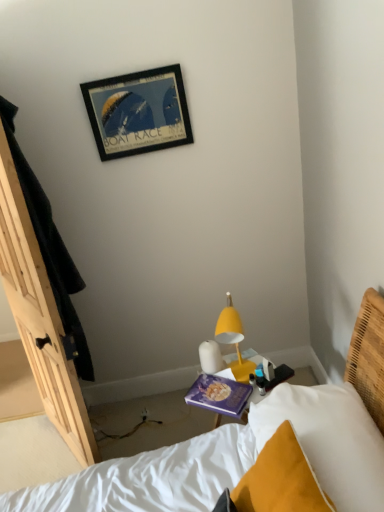
Where is `empty space that is ontop of purple matte book at center (from a real-world perspective)`? The image size is (384, 512). empty space that is ontop of purple matte book at center (from a real-world perspective) is located at coordinates (216, 387).